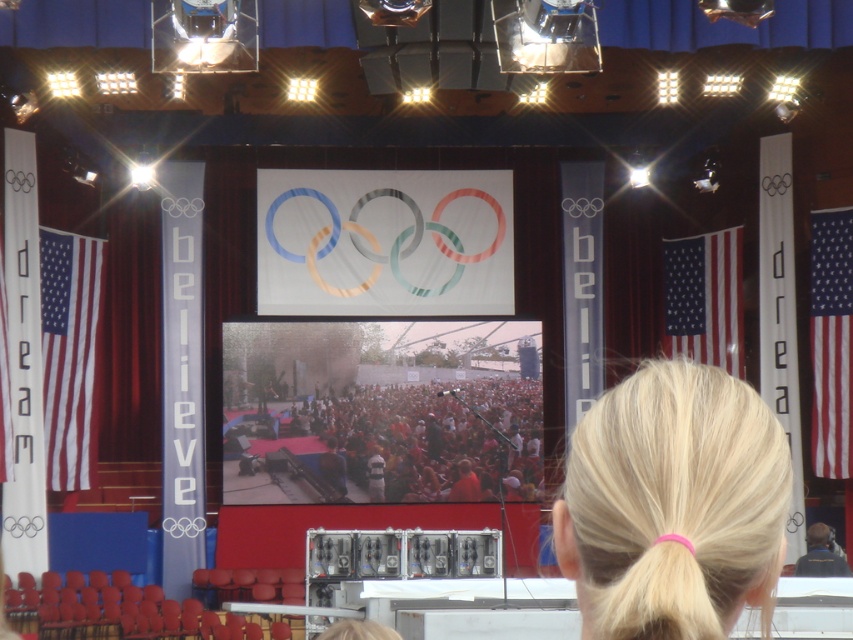
Identify the location of pink rubber band at upper center. (656, 586).

Where is `pink rubber band at upper center`? pink rubber band at upper center is located at coordinates (656, 586).

Is red fabric crowd at center wider than american flag at left?

Indeed, red fabric crowd at center has a greater width compared to american flag at left.

The height and width of the screenshot is (640, 853). I want to click on red fabric crowd at center, so click(x=432, y=440).

What are the coordinates of `red fabric crowd at center` in the screenshot? It's located at 432,440.

Does matte fabric flag at right lie behind dark blue fabric at center?

Yes.

Which is behind, point (679, 273) or point (819, 573)?

The point (679, 273) is more distant.

Who is more distant from viewer, (692, 272) or (811, 528)?

The point (692, 272) is behind.

Image resolution: width=853 pixels, height=640 pixels. Identify the location of matte fabric flag at right. (704, 298).